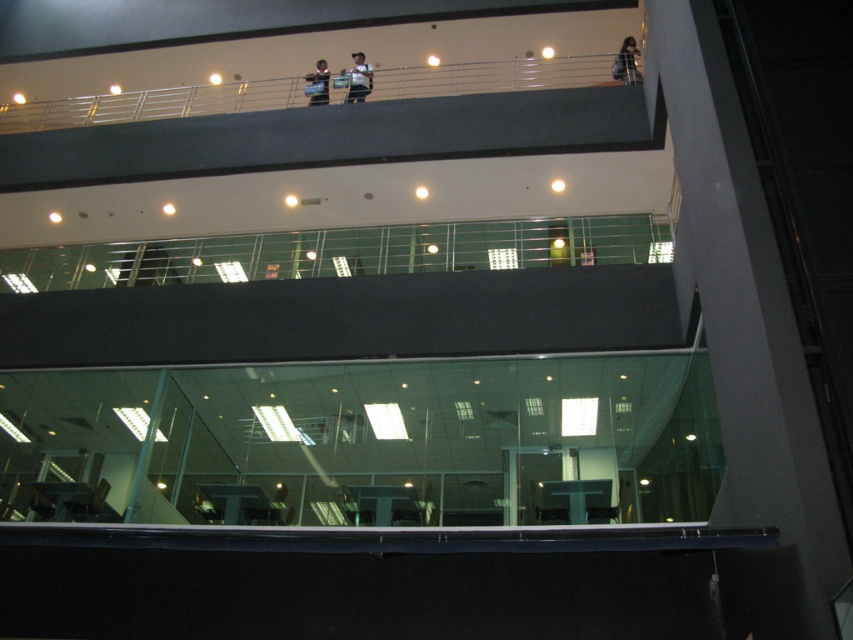
How much distance is there between white matte shirt at upper center and matte black camera at upper center?

18.44 inches

Does white matte shirt at upper center appear on the left side of matte black camera at upper center?

No, white matte shirt at upper center is not to the left of matte black camera at upper center.

What do you see at coordinates (358, 80) in the screenshot? The height and width of the screenshot is (640, 853). I see `white matte shirt at upper center` at bounding box center [358, 80].

Find the location of a particular element. white matte shirt at upper center is located at coordinates pyautogui.click(x=358, y=80).

Who is higher up, dark hair at upper center or matte black camera at upper center?

matte black camera at upper center is higher up.

Image resolution: width=853 pixels, height=640 pixels. What do you see at coordinates (625, 61) in the screenshot?
I see `dark hair at upper center` at bounding box center [625, 61].

The image size is (853, 640). I want to click on dark hair at upper center, so click(625, 61).

Is point (618, 67) less distant than point (364, 67)?

That is True.

Find the location of a particular element. The image size is (853, 640). dark hair at upper center is located at coordinates (625, 61).

Does point (633, 58) lie in front of point (358, 97)?

Yes, it is.

Where is `dark hair at upper center`? dark hair at upper center is located at coordinates (625, 61).